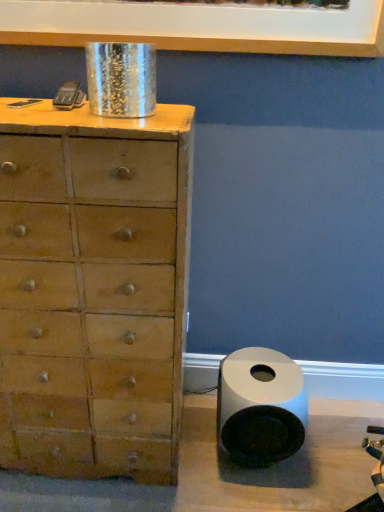
Where is `vacant point to the left of white glossy speaker at lower right`? The image size is (384, 512). vacant point to the left of white glossy speaker at lower right is located at coordinates (189, 455).